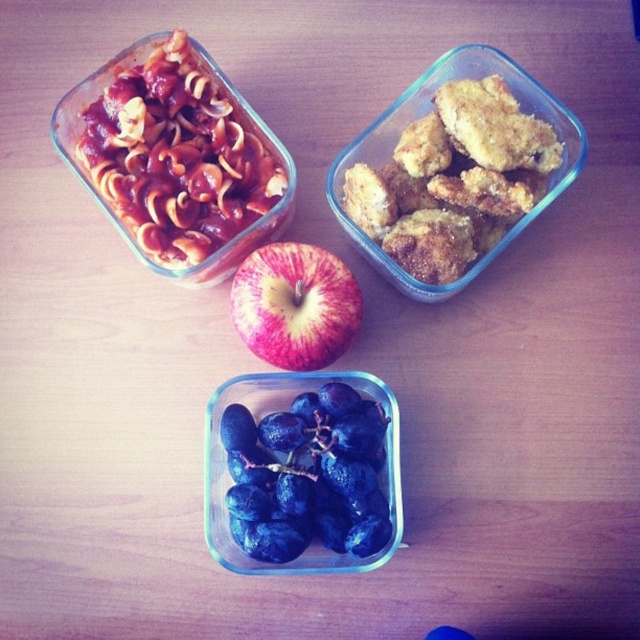
Between crispy golden nuggets at upper right and red matte apple at center, which one has less height?

With less height is red matte apple at center.

Does crispy golden nuggets at upper right have a greater width compared to red matte apple at center?

Correct, the width of crispy golden nuggets at upper right exceeds that of red matte apple at center.

Which is behind, point (456, 221) or point (300, 296)?

Positioned behind is point (456, 221).

Where is `crispy golden nuggets at upper right`? crispy golden nuggets at upper right is located at coordinates (452, 179).

Is point (253, 477) behind point (257, 264)?

Yes, it is.

Can you confirm if blue matte grapes at center is taller than red matte apple at center?

Yes, blue matte grapes at center is taller than red matte apple at center.

At what (x,y) coordinates should I click in order to perform the action: click on blue matte grapes at center. Please return your answer as a coordinate pair (x, y). Looking at the image, I should click on (307, 476).

Image resolution: width=640 pixels, height=640 pixels. I want to click on blue matte grapes at center, so click(307, 476).

Is crispy golden nuggets at upper right wider than blue matte grapes at center?

Indeed, crispy golden nuggets at upper right has a greater width compared to blue matte grapes at center.

Who is more distant from viewer, (500, 145) or (240, 499)?

The point (500, 145) is behind.

Which is behind, point (547, 131) or point (365, 461)?

Positioned behind is point (547, 131).

The height and width of the screenshot is (640, 640). I want to click on crispy golden nuggets at upper right, so click(452, 179).